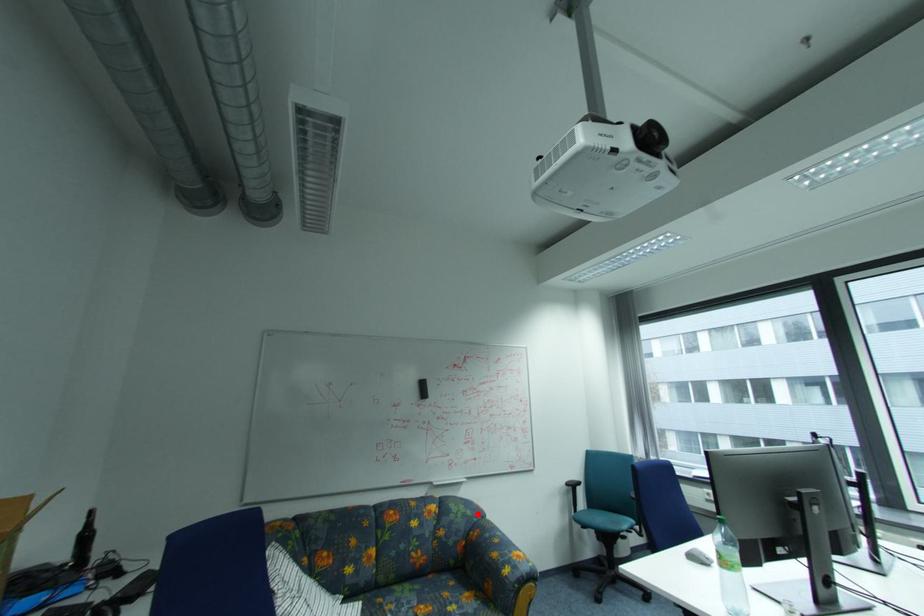
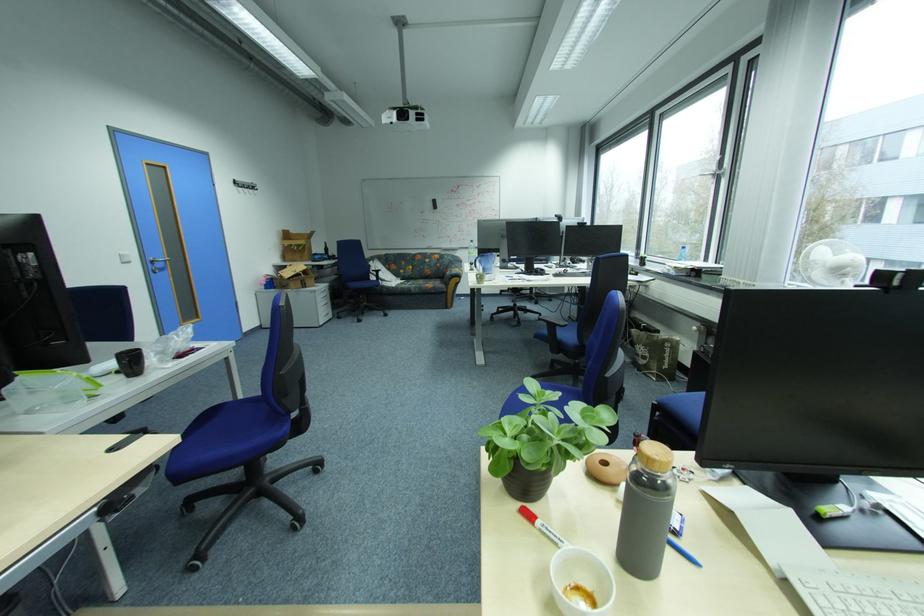
Locate, in the second image, the point that corresponds to the highlighted location in the first image.

(460, 261)